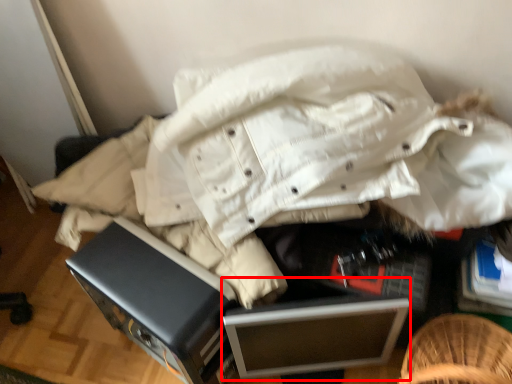
Question: Observing the image, what is the correct spatial positioning of file cabinet (annotated by the red box) in reference to furniture?

Choices:
 (A) right
 (B) left

Answer: (A)